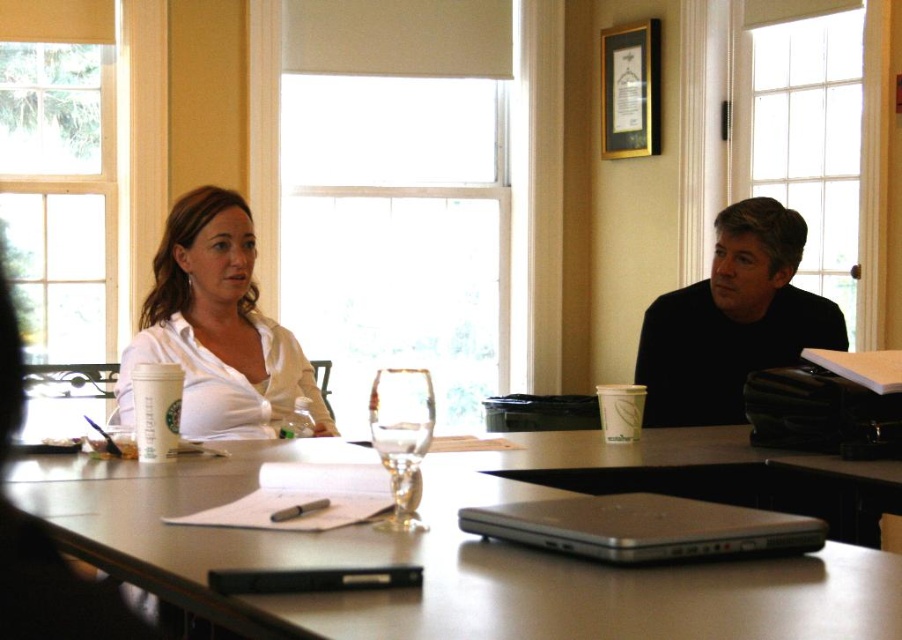
Question: Does black matte shirt at right appear under silver metallic laptop at center?

Choices:
 (A) no
 (B) yes

Answer: (A)

Question: From the image, what is the correct spatial relationship of white satin blouse at upper left in relation to clear glass wine glass at center?

Choices:
 (A) below
 (B) above

Answer: (B)

Question: Estimate the real-world distances between objects in this image. Which object is farther from the black matte shirt at right?

Choices:
 (A) white satin blouse at upper left
 (B) silver metallic laptop at center
 (C) matte silver laptop at center
 (D) clear glass wine glass at center

Answer: (D)

Question: Which point is closer to the camera taking this photo?

Choices:
 (A) 647,326
 (B) 578,529
 (C) 242,310

Answer: (B)

Question: Does matte silver laptop at center have a lesser width compared to clear glass wine glass at center?

Choices:
 (A) no
 (B) yes

Answer: (A)

Question: Among these objects, which one is farthest from the camera?

Choices:
 (A) white satin blouse at upper left
 (B) clear glass wine glass at center
 (C) silver metallic laptop at center
 (D) black matte shirt at right

Answer: (D)